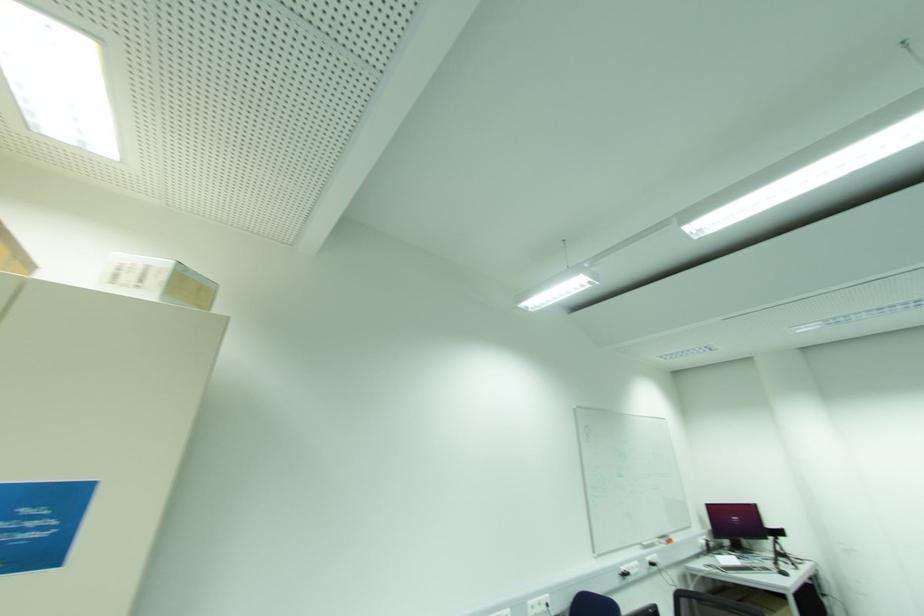
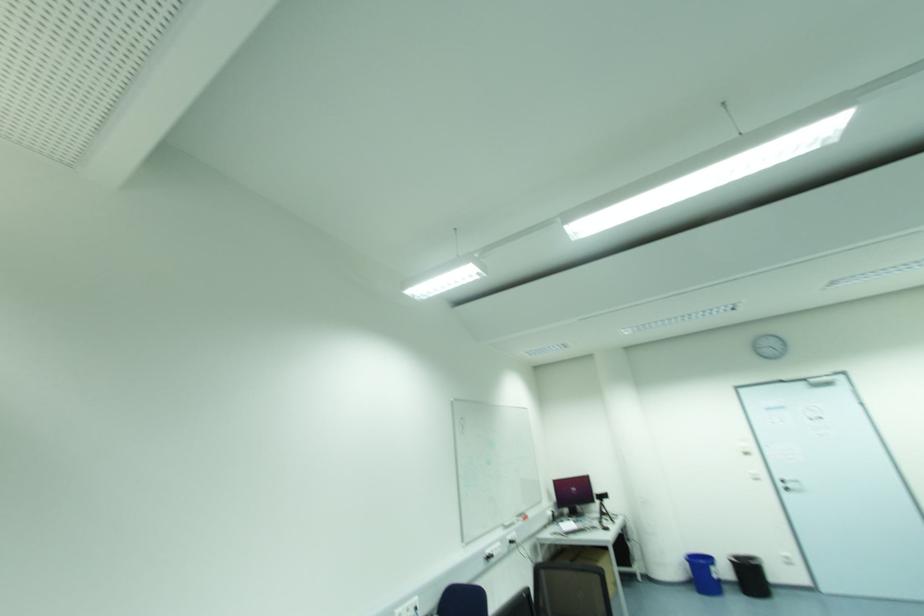
Question: The first image is from the beginning of the video and the second image is from the end. How did the camera likely rotate when shooting the video?

Choices:
 (A) Left
 (B) Right
 (C) Up
 (D) Down

Answer: (B)